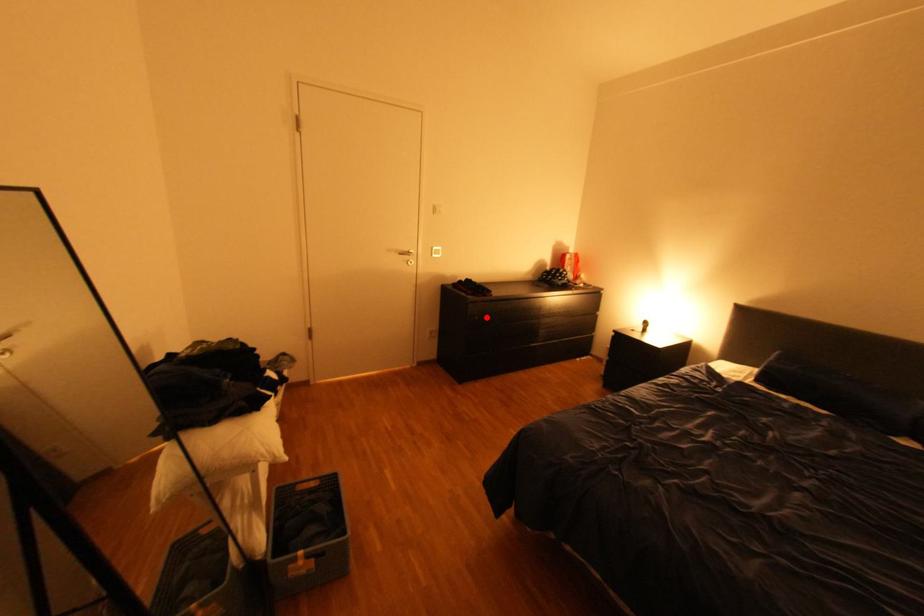
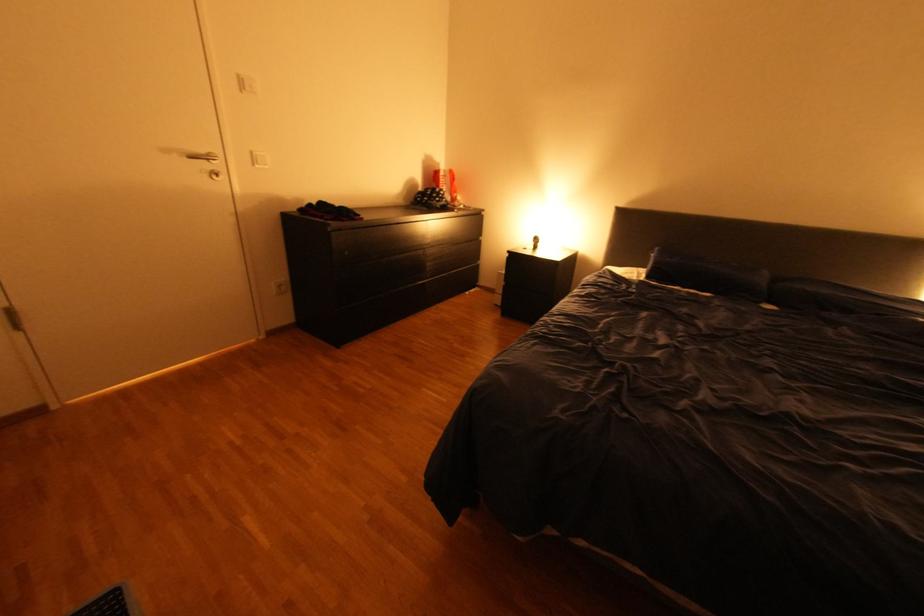
Locate, in the second image, the point that corresponds to the highlighted location in the first image.

(357, 253)